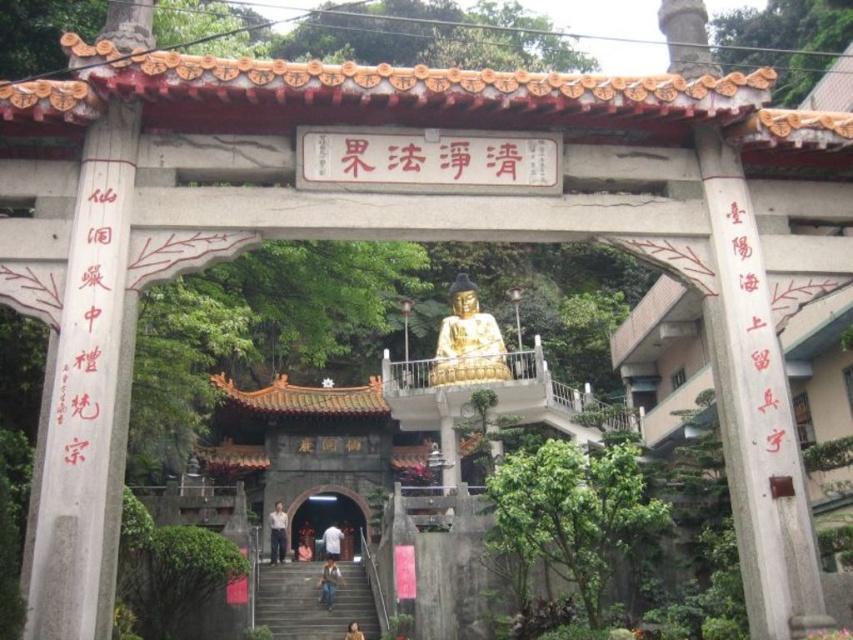
Can you confirm if gray concrete stairs at lower center is taller than white cotton shirt at center?

Indeed, gray concrete stairs at lower center has a greater height compared to white cotton shirt at center.

Is gray concrete stairs at lower center thinner than white cotton shirt at center?

No.

Does point (364, 621) come in front of point (334, 545)?

Yes.

Locate an element on the screen. Image resolution: width=853 pixels, height=640 pixels. gray concrete stairs at lower center is located at coordinates (312, 602).

Between black calligraphy at left and smooth stone archway at center, which one has more height?

black calligraphy at left

Does black calligraphy at left appear on the right side of smooth stone archway at center?

In fact, black calligraphy at left is to the left of smooth stone archway at center.

Measure the distance between black calligraphy at left and camera.

A distance of 57.90 feet exists between black calligraphy at left and camera.

Image resolution: width=853 pixels, height=640 pixels. Find the location of `black calligraphy at left`. black calligraphy at left is located at coordinates (90, 324).

Between gold polished statue at center and light brown fabric shirt at center, which one has less height?

Standing shorter between the two is light brown fabric shirt at center.

Is gold polished statue at center positioned before light brown fabric shirt at center?

That is False.

The image size is (853, 640). I want to click on gold polished statue at center, so click(467, 340).

This screenshot has width=853, height=640. In order to click on gold polished statue at center in this screenshot , I will do `click(467, 340)`.